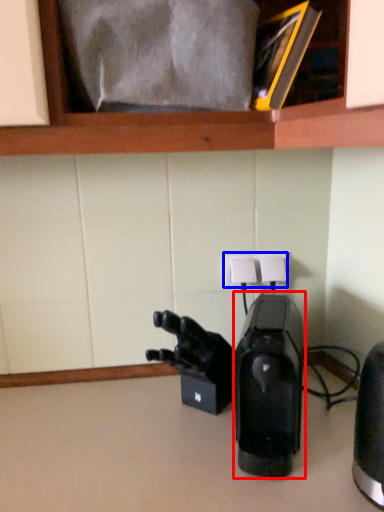
Question: Which object appears closest to the camera in this image, home appliance (highlighted by a red box) or electric outlet (highlighted by a blue box)?

Choices:
 (A) home appliance
 (B) electric outlet

Answer: (A)